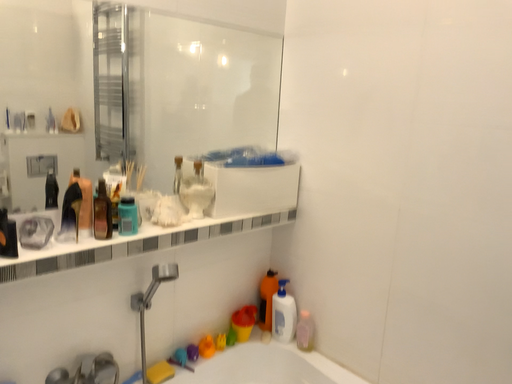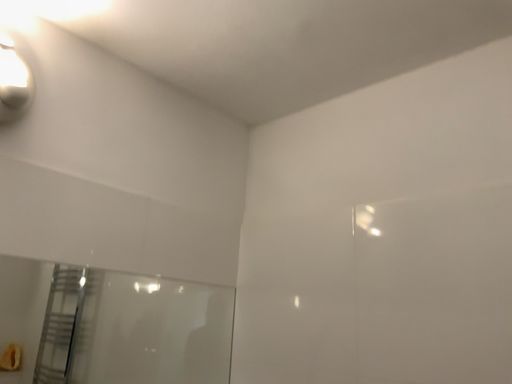
Question: Which way did the camera rotate in the video?

Choices:
 (A) rotated downward
 (B) rotated upward

Answer: (B)